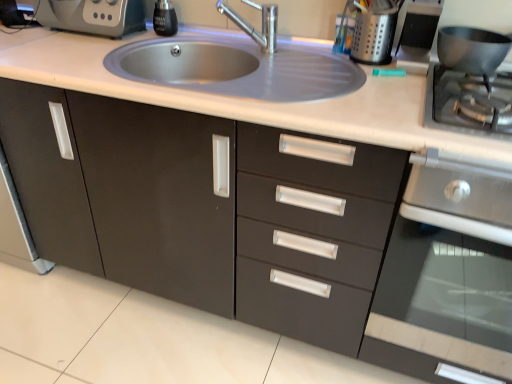
You are a GUI agent. You are given a task and a screenshot of the screen. Output one action in this format:
    pyautogui.click(x=<x>, y=<y>)
    Task: Click on the vacant area that lies between metallic gray coffee machine at upper left and satin steel sink at center
    
    Given the screenshot: What is the action you would take?
    68,54